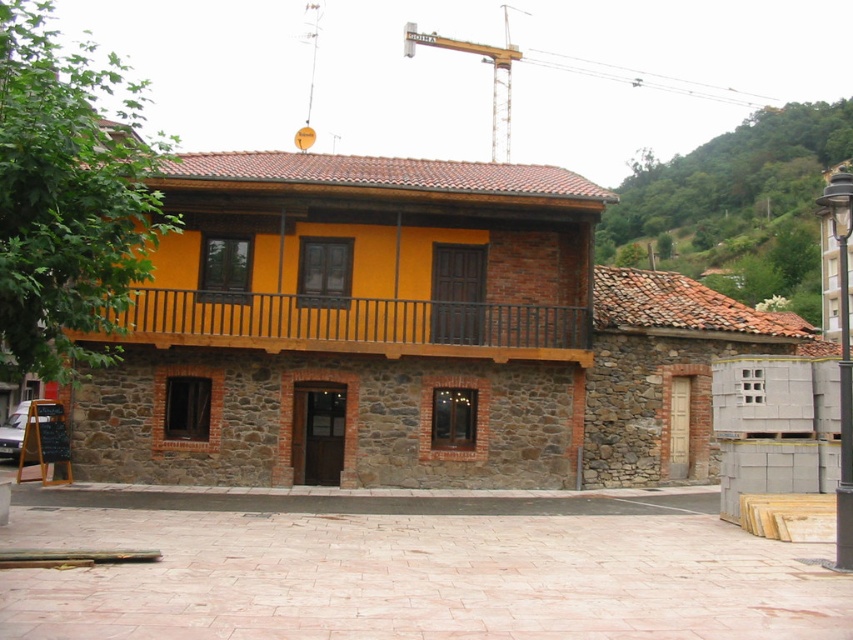
Who is positioned more to the left, green leafy hillside at upper right or wooden at upper center?

Positioned to the left is wooden at upper center.

Is the position of green leafy hillside at upper right less distant than that of wooden at upper center?

No, green leafy hillside at upper right is behind wooden at upper center.

Is point (636, 172) positioned after point (567, 326)?

Yes, point (636, 172) is behind point (567, 326).

This screenshot has width=853, height=640. I want to click on green leafy hillside at upper right, so click(x=737, y=204).

Who is shorter, green leafy hillside at upper right or metallic yellow crane at upper center?

green leafy hillside at upper right is shorter.

Who is higher up, green leafy hillside at upper right or metallic yellow crane at upper center?

metallic yellow crane at upper center

The width and height of the screenshot is (853, 640). I want to click on green leafy hillside at upper right, so click(737, 204).

Measure the distance between wooden at upper center and camera.

wooden at upper center and camera are 17.81 meters apart from each other.

Where is `wooden at upper center`? This screenshot has height=640, width=853. wooden at upper center is located at coordinates (354, 324).